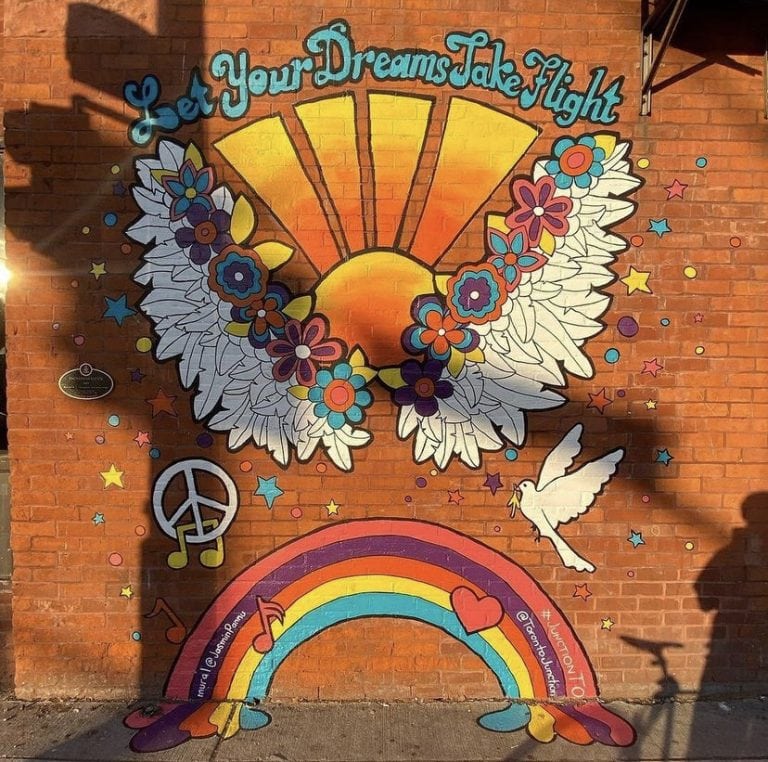
Identify the location of wall. The height and width of the screenshot is (762, 768). (31, 492).